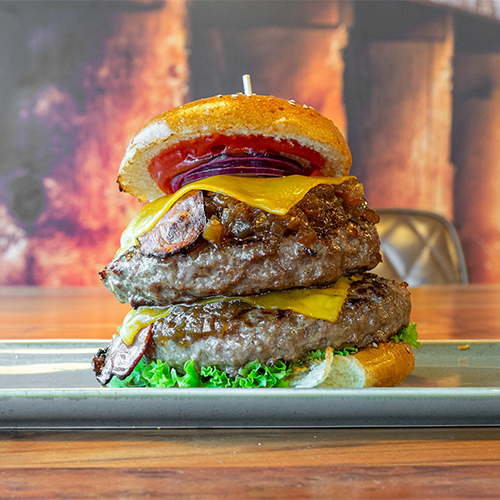
Where is `metal tray`? The image size is (500, 500). metal tray is located at coordinates (450, 401).